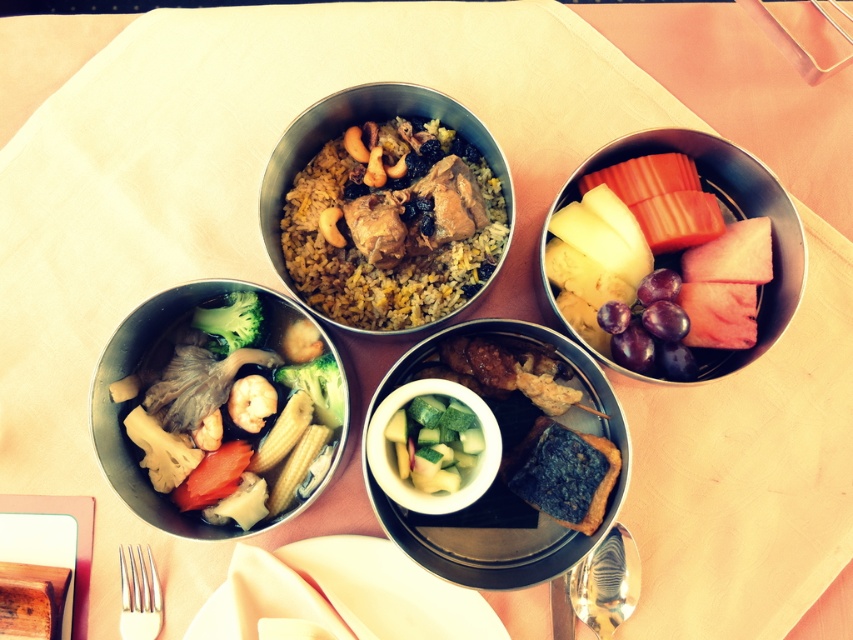
Can you confirm if shiny metallic bowl at lower left is thinner than shiny metallic spoon at bottom right?

No.

Is point (279, 353) more distant than point (585, 614)?

Yes, point (279, 353) is behind point (585, 614).

At what (x,y) coordinates should I click in order to perform the action: click on shiny metallic bowl at lower left. Please return your answer as a coordinate pair (x, y). Looking at the image, I should click on (213, 404).

Can you confirm if shiny metallic bowl at lower left is positioned below metallic silver bowl at upper right?

Yes.

Can you confirm if shiny metallic bowl at lower left is shorter than metallic silver bowl at upper right?

No.

Is point (236, 420) more distant than point (636, 134)?

Yes, it is.

You are a GUI agent. You are given a task and a screenshot of the screen. Output one action in this format:
    pyautogui.click(x=<x>, y=<y>)
    Task: Click on the shiny metallic bowl at lower left
    The width and height of the screenshot is (853, 640).
    Given the screenshot: What is the action you would take?
    pyautogui.click(x=213, y=404)

Can you confirm if yellow rice with meat at center is positioned above green broccoli at lower left?

Yes, yellow rice with meat at center is above green broccoli at lower left.

Which is below, yellow rice with meat at center or green broccoli at lower left?

Positioned lower is green broccoli at lower left.

What do you see at coordinates (387, 208) in the screenshot? Image resolution: width=853 pixels, height=640 pixels. I see `yellow rice with meat at center` at bounding box center [387, 208].

At what (x,y) coordinates should I click in order to perform the action: click on yellow rice with meat at center. Please return your answer as a coordinate pair (x, y). This screenshot has width=853, height=640. Looking at the image, I should click on click(x=387, y=208).